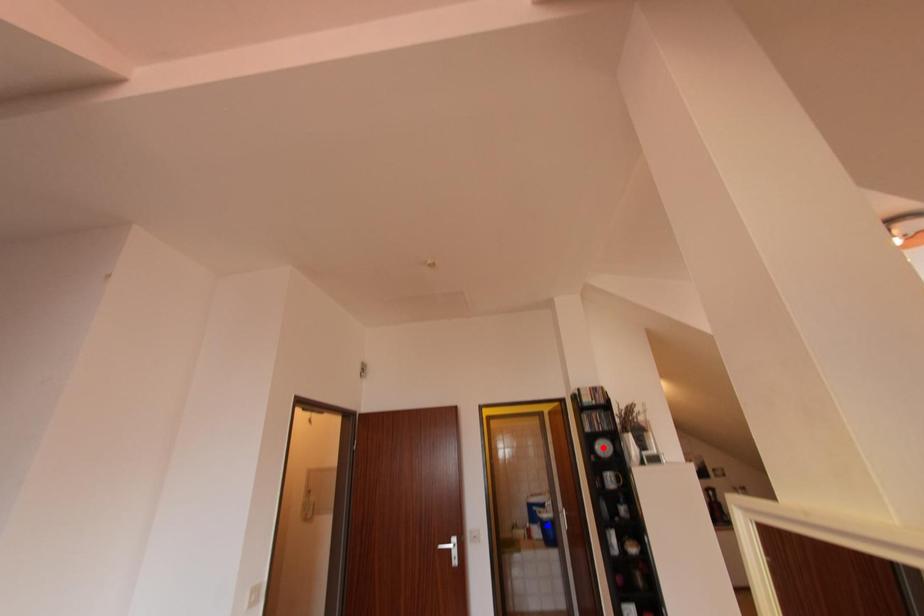
Question: Which of the two points in the image is closer to the camera?

Choices:
 (A) Blue point is closer.
 (B) Red point is closer.

Answer: (B)